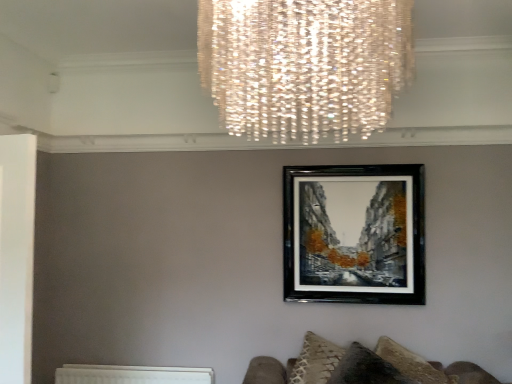
You are a GUI agent. You are given a task and a screenshot of the screen. Output one action in this format:
    pyautogui.click(x=<x>, y=<y>)
    Task: Click on the white textured radiator at lower left
    This screenshot has height=384, width=512.
    Given the screenshot: What is the action you would take?
    pyautogui.click(x=131, y=375)

Identify the location of white textured radiator at lower left. This screenshot has width=512, height=384. (131, 375).

Is black glossy picture frame at center oriented towards velvet textured cushion at lower right?

No, black glossy picture frame at center is not turned towards velvet textured cushion at lower right.

Which object is positioned more to the right, black glossy picture frame at center or velvet textured cushion at lower right?

From the viewer's perspective, velvet textured cushion at lower right appears more on the right side.

Which point is more forward, [411,253] or [339,352]?

Point [339,352]

From the image's perspective, would you say white textured radiator at lower left is shown under black glossy picture frame at center?

Yes, from the image's perspective, white textured radiator at lower left is below black glossy picture frame at center.

Who is bigger, white textured radiator at lower left or black glossy picture frame at center?

black glossy picture frame at center is bigger.

In terms of width, does white textured radiator at lower left look wider or thinner when compared to black glossy picture frame at center?

white textured radiator at lower left is wider than black glossy picture frame at center.

In the image, is black glossy picture frame at center positioned in front of or behind white textured radiator at lower left?

In the image, black glossy picture frame at center appears in front of white textured radiator at lower left.

The image size is (512, 384). I want to click on radiator below the black glossy picture frame at center (from the image's perspective), so click(x=131, y=375).

From a real-world perspective, is black glossy picture frame at center above or below white textured radiator at lower left?

From a real-world perspective, black glossy picture frame at center is physically above white textured radiator at lower left.

Which object is further away from the camera taking this photo, velvet textured cushion at lower right or white textured radiator at lower left?

white textured radiator at lower left is further from the camera.

Is velvet textured cushion at lower right taller or shorter than white textured radiator at lower left?

Considering their sizes, velvet textured cushion at lower right has more height than white textured radiator at lower left.

In the scene shown: Is velvet textured cushion at lower right smaller than white textured radiator at lower left?

Incorrect, velvet textured cushion at lower right is not smaller in size than white textured radiator at lower left.

In the scene shown: From the image's perspective, does velvet textured cushion at lower right appear higher than white textured radiator at lower left?

Yes, from the image's perspective, velvet textured cushion at lower right is on top of white textured radiator at lower left.

Locate an element on the screen. The width and height of the screenshot is (512, 384). radiator behind the velvet textured cushion at lower right is located at coordinates (x=131, y=375).

From the image's perspective, would you say white textured radiator at lower left is positioned over velvet textured cushion at lower right?

No.

Is white textured radiator at lower left positioned far away from velvet textured cushion at lower right?

Yes, white textured radiator at lower left and velvet textured cushion at lower right are quite far apart.

From a real-world perspective, between white textured radiator at lower left and velvet textured cushion at lower right, who is vertically lower?

white textured radiator at lower left is physically lower.

Are velvet textured cushion at lower right and black glossy picture frame at center making contact?

No, velvet textured cushion at lower right is not making contact with black glossy picture frame at center.

Can you confirm if velvet textured cushion at lower right is positioned to the left of black glossy picture frame at center?

No, velvet textured cushion at lower right is not to the left of black glossy picture frame at center.

From a real-world perspective, which object stands above the other?

From a 3D spatial view, black glossy picture frame at center is above.

At what (x,y) coordinates should I click in order to perform the action: click on furniture beneath the black glossy picture frame at center (from a real-world perspective). Please return your answer as a coordinate pair (x, y). Looking at the image, I should click on (361, 366).

Image resolution: width=512 pixels, height=384 pixels. I want to click on radiator behind the black glossy picture frame at center, so click(x=131, y=375).

Estimate the real-world distances between objects in this image. Which object is further from white textured radiator at lower left, black glossy picture frame at center or velvet textured cushion at lower right?

The object further to white textured radiator at lower left is black glossy picture frame at center.

When comparing their distances from velvet textured cushion at lower right, does black glossy picture frame at center or white textured radiator at lower left seem closer?

Based on the image, black glossy picture frame at center appears to be nearer to velvet textured cushion at lower right.

Looking at the image, which one is located closer to velvet textured cushion at lower right, white textured radiator at lower left or black glossy picture frame at center?

Based on the image, black glossy picture frame at center appears to be nearer to velvet textured cushion at lower right.

In the scene shown: Considering their positions, is white textured radiator at lower left positioned further to black glossy picture frame at center than velvet textured cushion at lower right?

white textured radiator at lower left is positioned further to the anchor black glossy picture frame at center.

From the image, which object appears to be nearer to black glossy picture frame at center, velvet textured cushion at lower right or white textured radiator at lower left?

velvet textured cushion at lower right lies closer to black glossy picture frame at center than the other object.

Considering their positions, is velvet textured cushion at lower right positioned closer to white textured radiator at lower left than black glossy picture frame at center?

Based on the image, velvet textured cushion at lower right appears to be nearer to white textured radiator at lower left.

The height and width of the screenshot is (384, 512). In order to click on picture frame located between white textured radiator at lower left and velvet textured cushion at lower right in the left-right direction in this screenshot , I will do `click(356, 236)`.